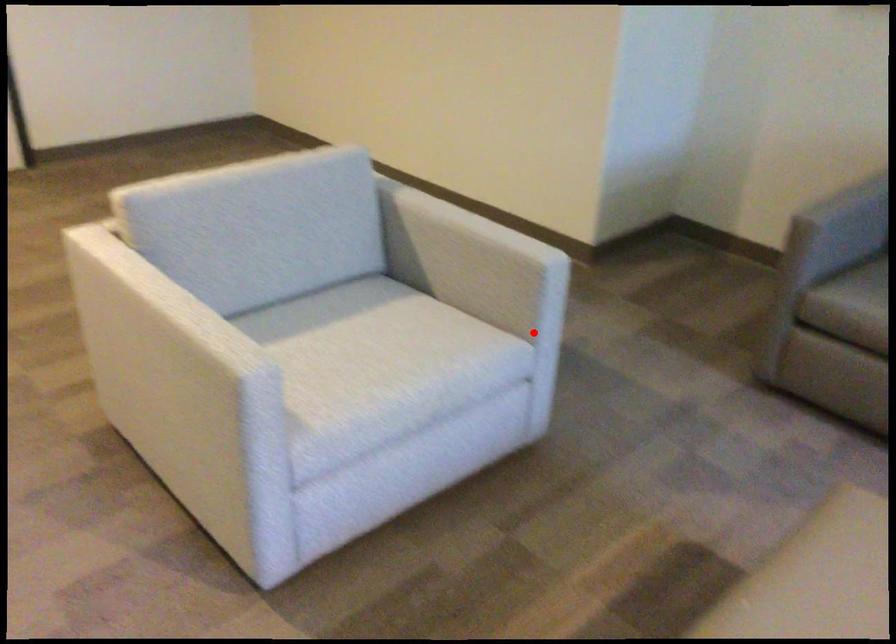
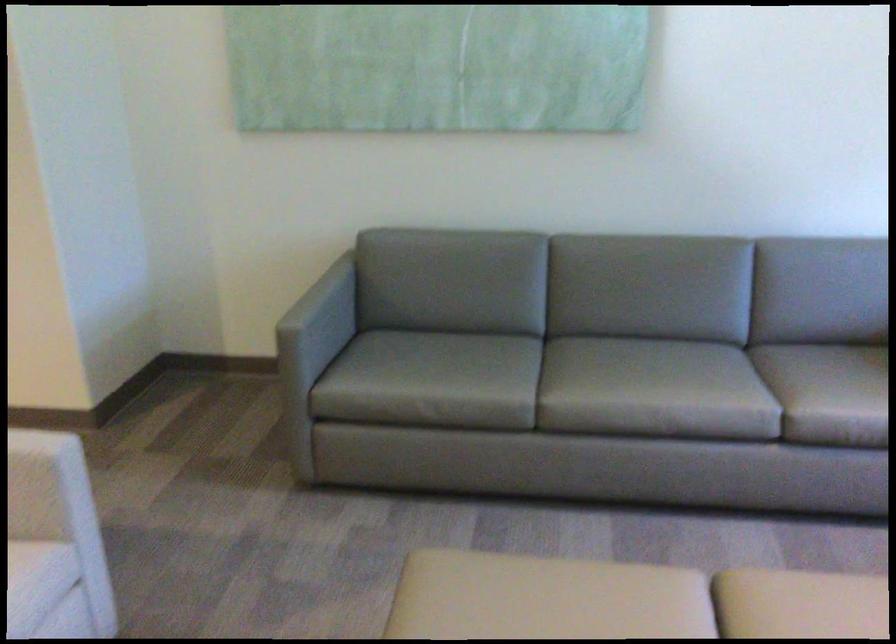
Question: A red point is marked in image1. In image2, is the corresponding 3D point closer to the camera or farther? Reply with the corresponding letter.

Choices:
 (A) The corresponding 3D point is closer.
 (B) The corresponding 3D point is farther.

Answer: (A)